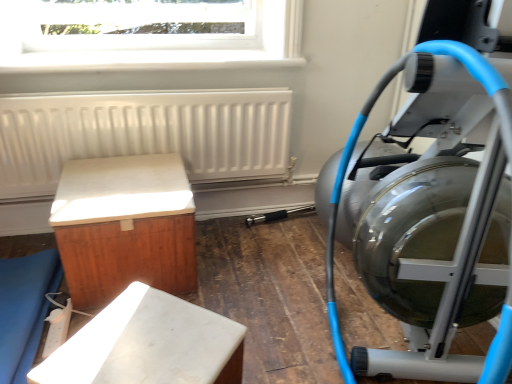
Question: In terms of height, does matte wood bench at lower left, which is the first furniture from left to right, look taller or shorter compared to transparent glass window at upper center?

Choices:
 (A) tall
 (B) short

Answer: (B)

Question: In terms of size, does matte wood bench at lower left, which is the first furniture from left to right, appear bigger or smaller than transparent glass window at upper center?

Choices:
 (A) big
 (B) small

Answer: (A)

Question: Estimate the real-world distances between objects in this image. Which object is closer to the silver metallic stationary bicycle at right?

Choices:
 (A) white marble bench at lower center, the first furniture from the right
 (B) white matte cabinet at left, marked as the 2th furniture in a left-to-right arrangement
 (C) transparent glass window at upper center
 (D) white matte radiator at upper left
 (E) matte wood bench at lower left, which is the first furniture from left to right

Answer: (A)

Question: Estimate the real-world distances between objects in this image. Which object is farther from the matte wood bench at lower left, which is the first furniture from left to right?

Choices:
 (A) white marble bench at lower center, the first furniture from the right
 (B) silver metallic stationary bicycle at right
 (C) transparent glass window at upper center
 (D) white matte radiator at upper left
 (E) white matte cabinet at left, which ranks as the 2th furniture in right-to-left order

Answer: (B)